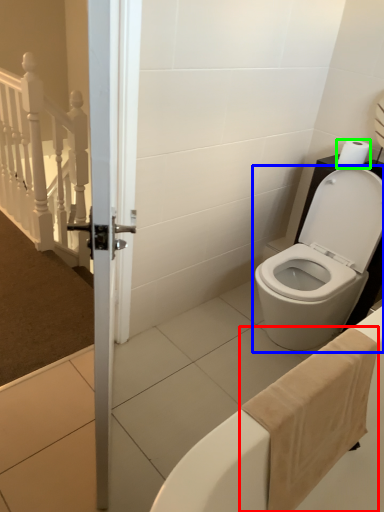
Question: Which is nearer to the bath towel (highlighted by a red box)? toilet (highlighted by a blue box) or toilet paper (highlighted by a green box).

Choices:
 (A) toilet
 (B) toilet paper

Answer: (A)